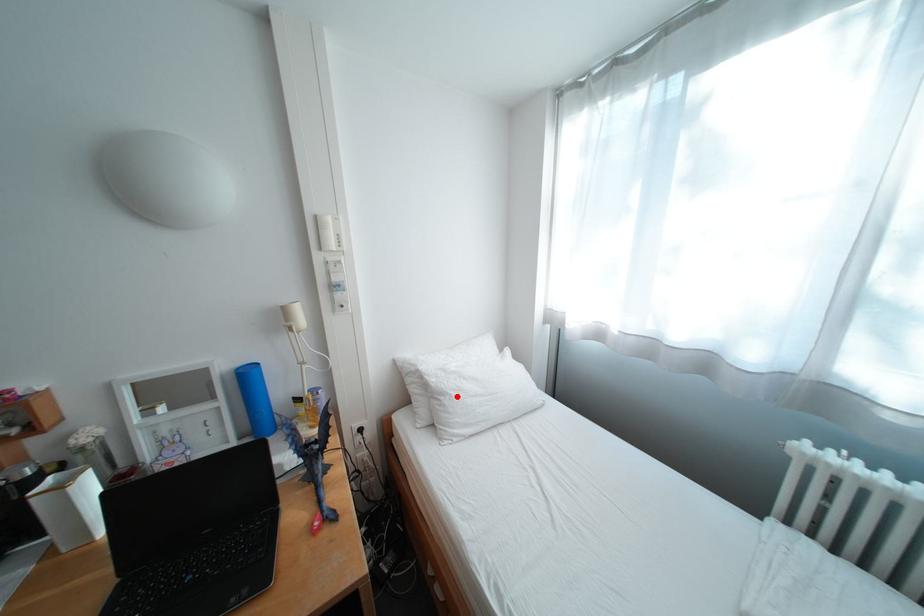
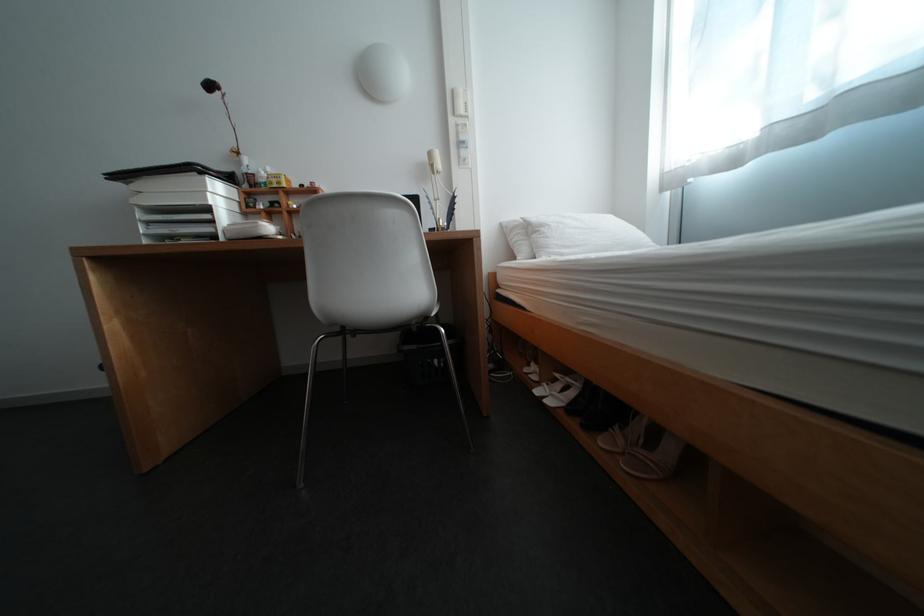
Question: I am providing you with two images of the same scene from different viewpoints. Image1 has a red point marked. In image2, the corresponding 3D location appears at what relative position? Reply with the corresponding letter.

Choices:
 (A) Closer
 (B) Farther

Answer: (A)